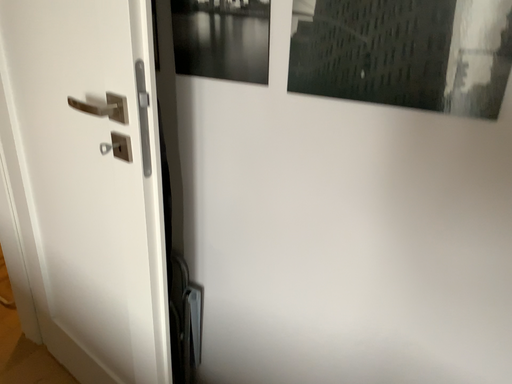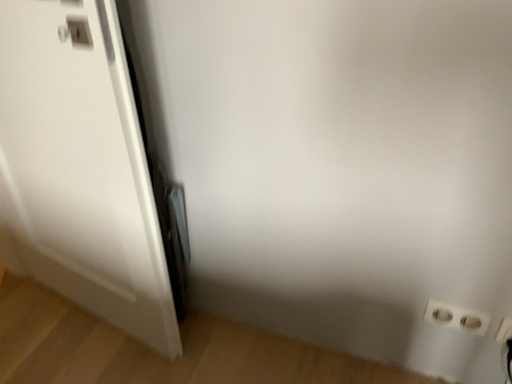
Question: Which way did the camera rotate in the video?

Choices:
 (A) rotated downward
 (B) rotated upward

Answer: (A)